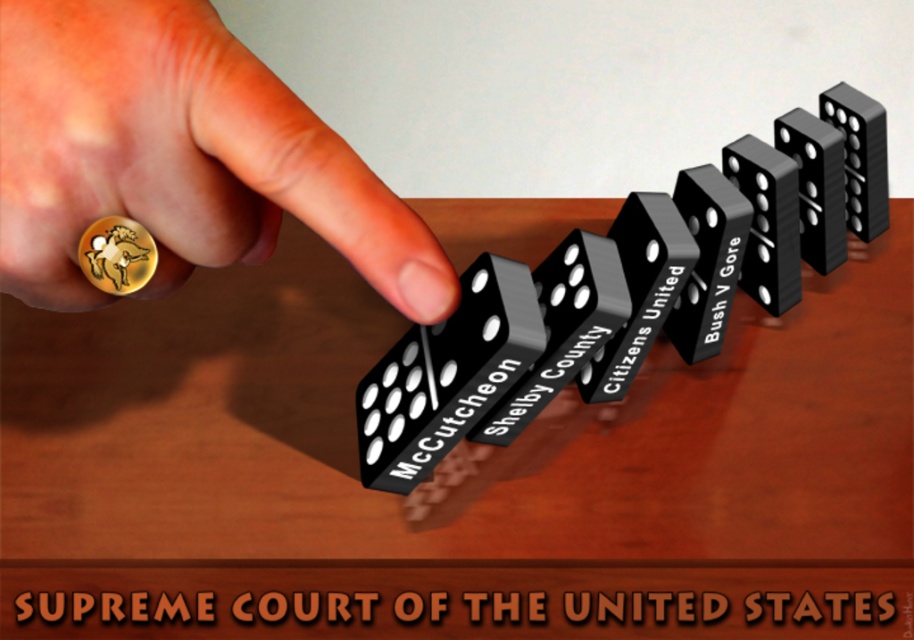
Question: Which point is farther from the camera taking this photo?

Choices:
 (A) (852, 192)
 (B) (131, 532)
 (C) (540, 378)
 (D) (51, 237)

Answer: (A)

Question: Based on their relative distances, which object is farther from the wooden table at center?

Choices:
 (A) gold ring at left
 (B) black plastic dominoes at center
 (C) black plastic domino at upper right

Answer: (C)

Question: Which point is closer to the camera taking this photo?

Choices:
 (A) (434, 417)
 (B) (862, 100)
 (C) (360, 216)
 (D) (362, 552)

Answer: (C)

Question: In this image, where is wooden table at center located relative to gold ring at left?

Choices:
 (A) left
 (B) right

Answer: (B)

Question: Can you confirm if wooden table at center is smaller than black plastic domino at upper right?

Choices:
 (A) yes
 (B) no

Answer: (B)

Question: Can you confirm if wooden table at center is positioned to the right of black plastic dominoes at center?

Choices:
 (A) yes
 (B) no

Answer: (B)